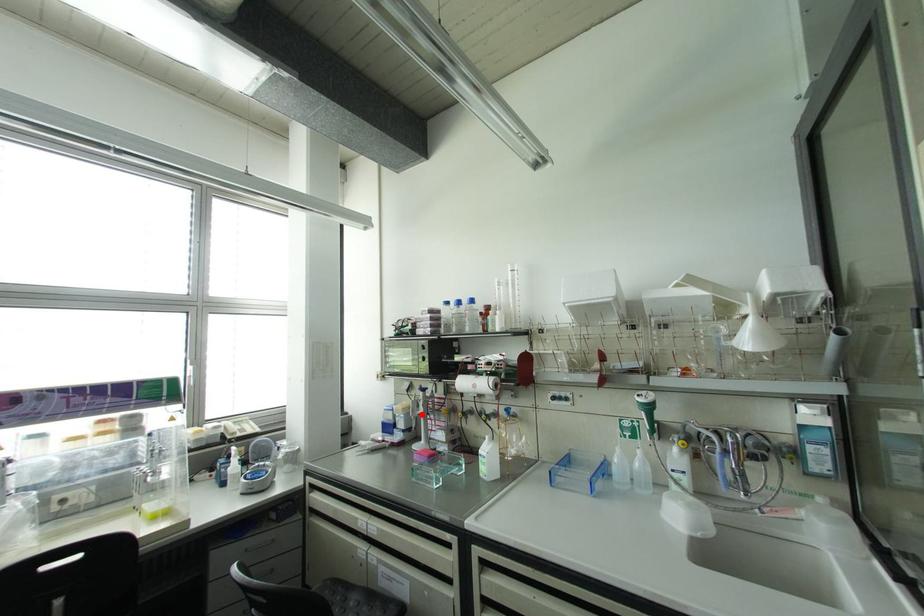
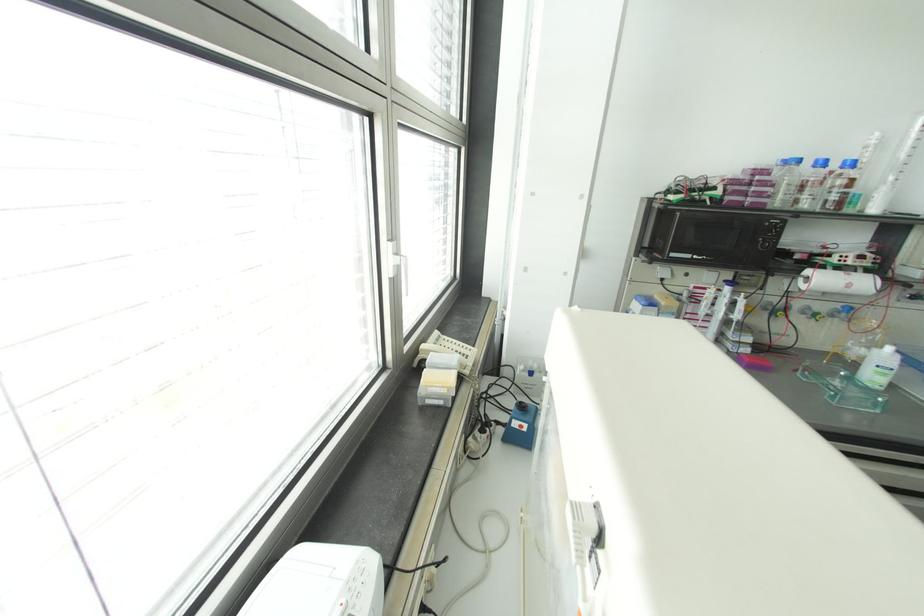
Question: I am providing you with two images of the same scene from different viewpoints. Given a red point in image1, look at the same physical point in image2. Is it:

Choices:
 (A) Closer to the viewpoint
 (B) Farther from the viewpoint

Answer: (A)